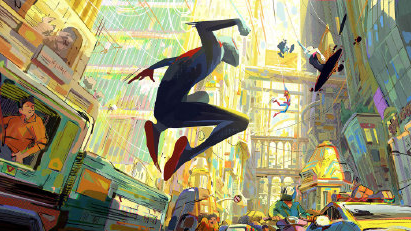
The image size is (411, 231). I want to click on entry, so click(x=10, y=114).